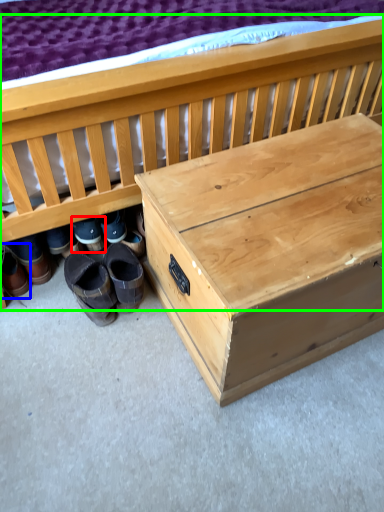
Question: Which object is the closest to the footwear (highlighted by a red box)? Choose among these: footwear (highlighted by a blue box) or furniture (highlighted by a green box).

Choices:
 (A) footwear
 (B) furniture

Answer: (A)